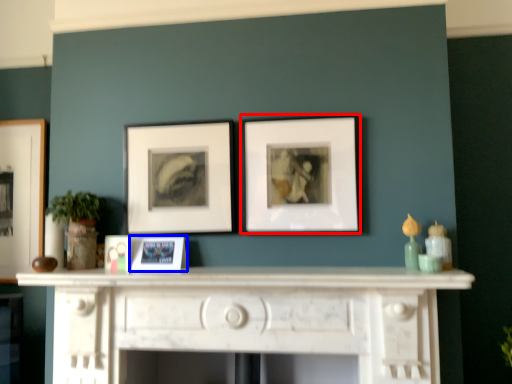
Question: Which object appears farthest to the camera in this image, picture frame (highlighted by a red box) or picture frame (highlighted by a blue box)?

Choices:
 (A) picture frame
 (B) picture frame

Answer: (B)